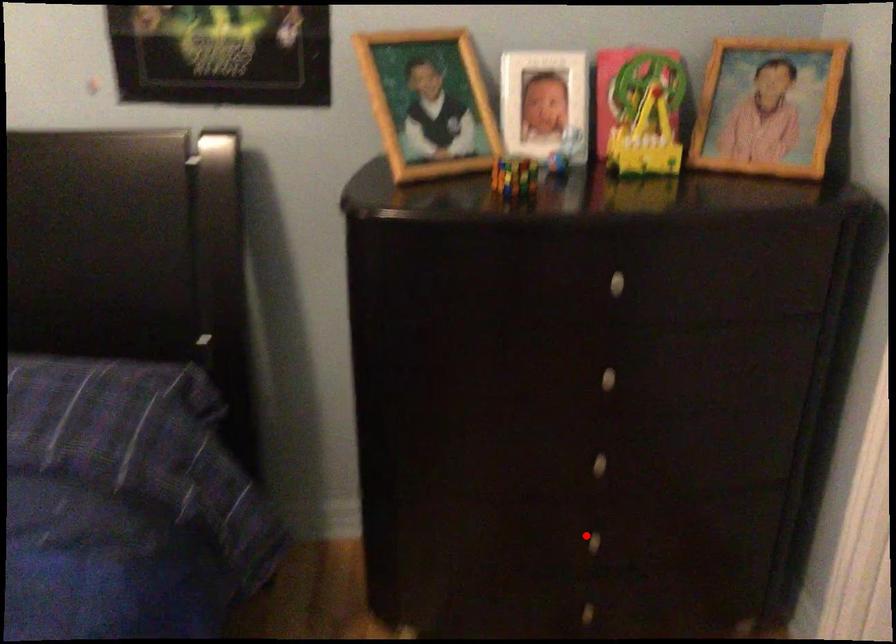
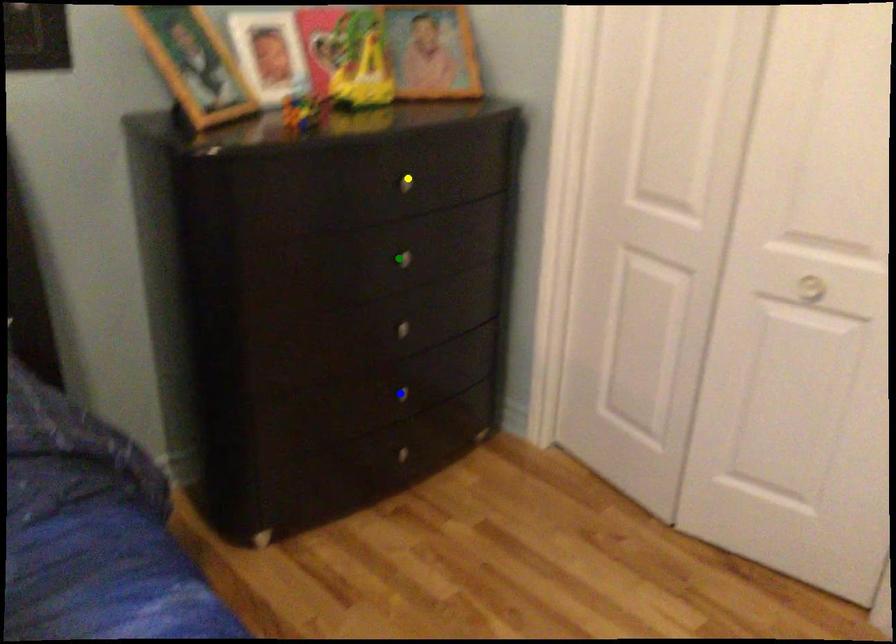
Question: I am providing you with two images of the same scene from different viewpoints. A red point is marked on the first image. You are given multiple points on the second image. Can you choose the point in image 2 that corresponds to the point in image 1?

Choices:
 (A) yellow point
 (B) blue point
 (C) green point

Answer: (B)